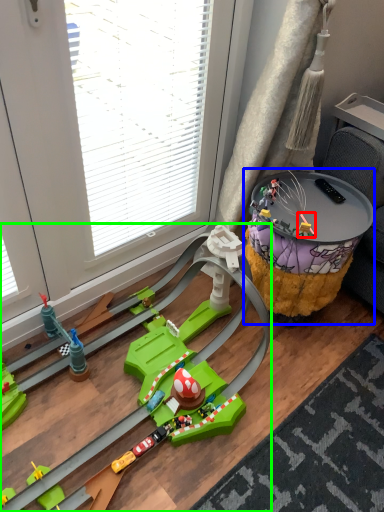
Question: Estimate the real-world distances between objects in this image. Which object is closer to toy (highlighted by a red box), table (highlighted by a blue box) or toy (highlighted by a green box)?

Choices:
 (A) table
 (B) toy

Answer: (A)